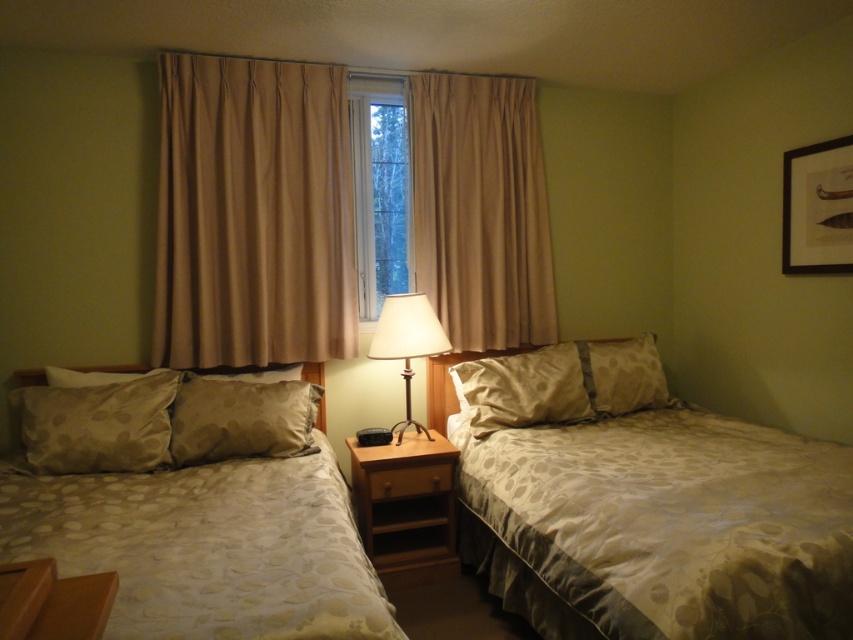
What do you see at coordinates (241, 419) in the screenshot?
I see `beige textured pillow at center` at bounding box center [241, 419].

Who is more distant from viewer, [206,385] or [375,346]?

The point [375,346] is behind.

Image resolution: width=853 pixels, height=640 pixels. Find the location of `beige textured pillow at center`. beige textured pillow at center is located at coordinates (241, 419).

Is beige fabric curtain at center thinner than beige dotted pillow at right?

In fact, beige fabric curtain at center might be wider than beige dotted pillow at right.

Who is positioned more to the right, beige fabric curtain at center or beige dotted pillow at right?

From the viewer's perspective, beige dotted pillow at right appears more on the right side.

This screenshot has height=640, width=853. Find the location of `beige fabric curtain at center`. beige fabric curtain at center is located at coordinates click(x=480, y=209).

You are a GUI agent. You are given a task and a screenshot of the screen. Output one action in this format:
    pyautogui.click(x=<x>, y=<y>)
    Task: Click on the beige fabric curtain at center
    This screenshot has height=640, width=853.
    Given the screenshot: What is the action you would take?
    point(480,209)

Does matte beige bed at right appear on the left side of beige textured pillow at center?

In fact, matte beige bed at right is to the right of beige textured pillow at center.

Describe the element at coordinates (645, 504) in the screenshot. I see `matte beige bed at right` at that location.

Is point (785, 627) positioned before point (177, 417)?

Yes.

The width and height of the screenshot is (853, 640). I want to click on matte beige bed at right, so click(x=645, y=504).